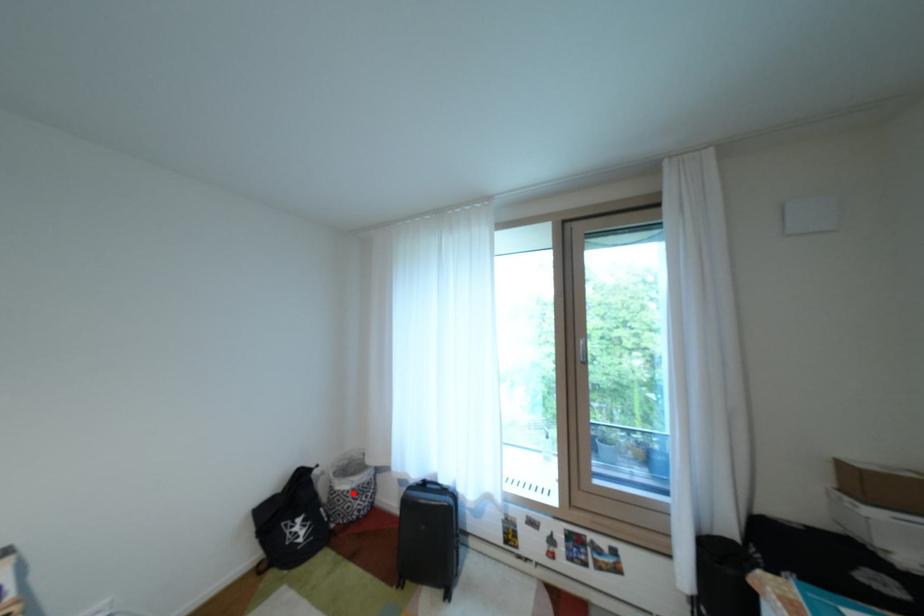
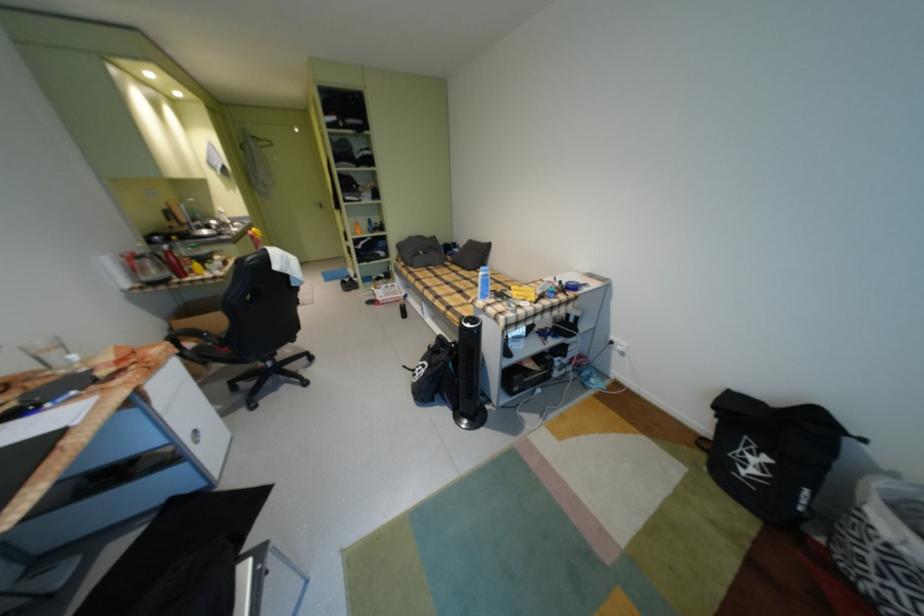
Question: I am providing you with two images of the same scene from different viewpoints. A red point is marked on the first image. At the location where the point appears in image 1, is it still visible in image 2?

Choices:
 (A) Yes
 (B) No

Answer: (A)